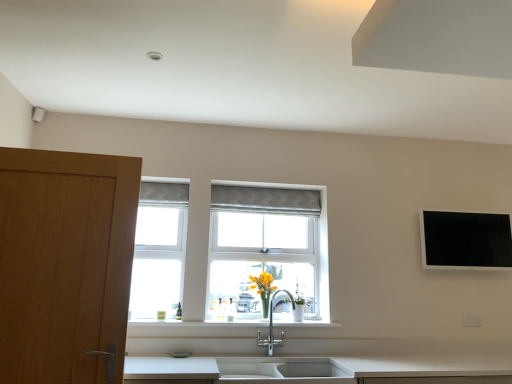
Question: From a real-world perspective, is white ceramic sink at lower center positioned above or below black glossy flat screen tv at upper right?

Choices:
 (A) below
 (B) above

Answer: (A)

Question: Visually, is white ceramic sink at lower center positioned to the left or to the right of black glossy flat screen tv at upper right?

Choices:
 (A) right
 (B) left

Answer: (B)

Question: Which of these objects is positioned farthest from the textured gray curtain at center?

Choices:
 (A) white plastic electric outlet at lower right
 (B) white plastic window frame at left
 (C) wooden door at left
 (D) black glossy flat screen tv at upper right
 (E) white ceramic sink at lower center

Answer: (A)

Question: Which is nearer to the white plastic electric outlet at lower right?

Choices:
 (A) white ceramic sink at lower center
 (B) wooden door at left
 (C) black glossy flat screen tv at upper right
 (D) textured gray curtain at center
 (E) white plastic window frame at left

Answer: (C)